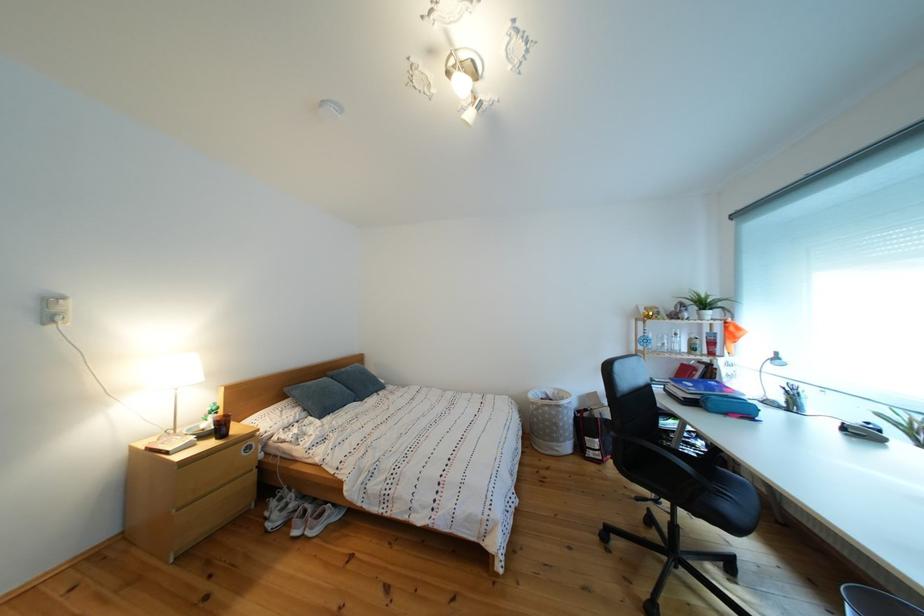
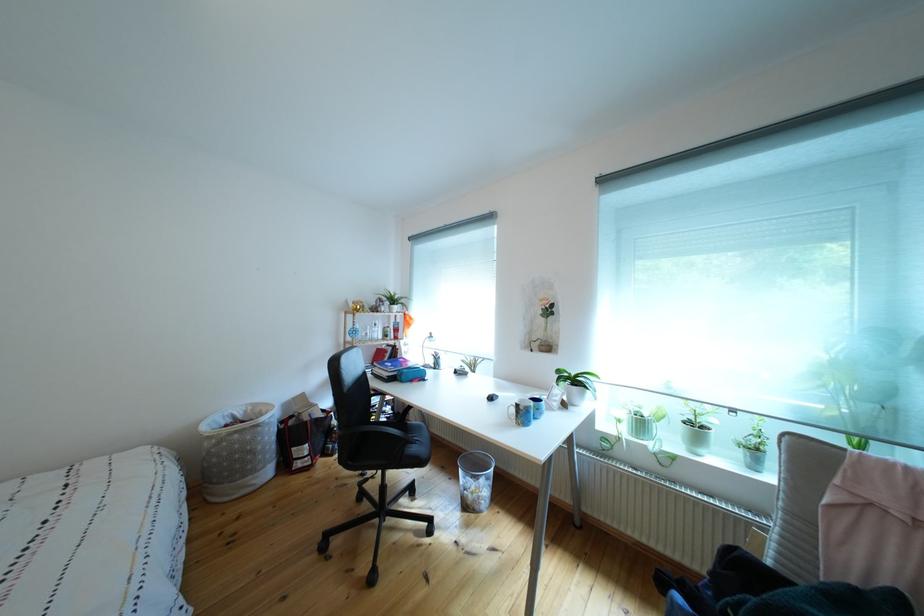
Where in the second image is the point corresponding to (x=683, y=358) from the first image?

(383, 345)